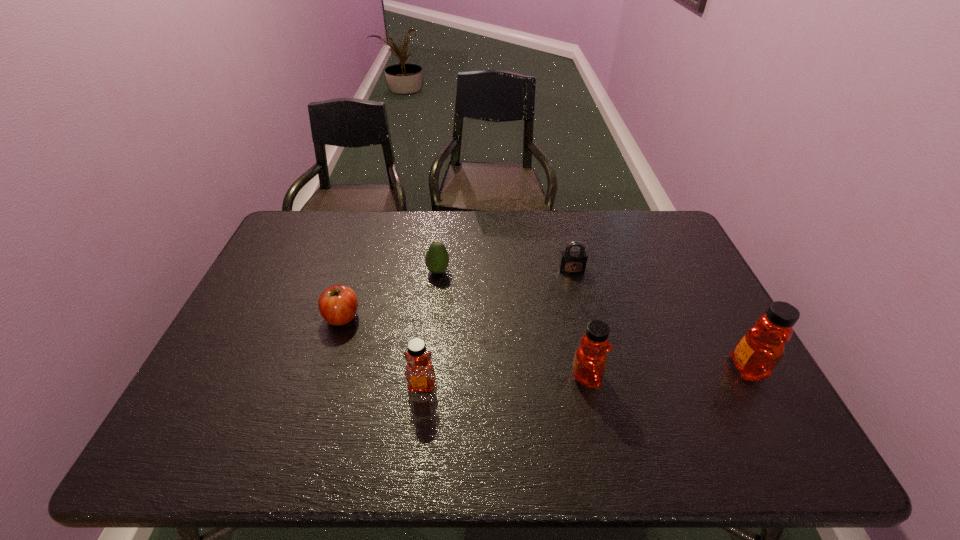
At what (x,y) coordinates should I click in order to perform the action: click on vacant area that lies between the apple and the avocado. Please return your answer as a coordinate pair (x, y). This screenshot has width=960, height=540. Looking at the image, I should click on (390, 294).

Locate an element on the screen. This screenshot has width=960, height=540. vacant point located between the avocado and the rightmost object is located at coordinates (592, 320).

Find the location of `free space between the avocado and the padlock`. free space between the avocado and the padlock is located at coordinates (505, 271).

The width and height of the screenshot is (960, 540). Identify the location of vacant region between the rightmost honey and the second honey from left to right. (667, 373).

Image resolution: width=960 pixels, height=540 pixels. What are the coordinates of `the fourth closest object to the leftmost object` in the screenshot? It's located at (571, 262).

Select which object is the fifth closest to the padlock. Please provide its 2D coordinates. Your answer should be formatted as a tuple, i.e. [(x, y)], where the tuple contains the x and y coordinates of a point satisfying the conditions above.

[(338, 304)]

Select which honey appears as the second closest to the rightmost honey. Please provide its 2D coordinates. Your answer should be formatted as a tuple, i.e. [(x, y)], where the tuple contains the x and y coordinates of a point satisfying the conditions above.

[(419, 372)]

Point out which honey is positioned as the second nearest to the leftmost object. Please provide its 2D coordinates. Your answer should be formatted as a tuple, i.e. [(x, y)], where the tuple contains the x and y coordinates of a point satisfying the conditions above.

[(588, 367)]

The height and width of the screenshot is (540, 960). Find the location of `vacant space that satisfies the following two spatial constraints: 1. on the front label of the second shortest honey; 2. on the front label of the third tallest object`. vacant space that satisfies the following two spatial constraints: 1. on the front label of the second shortest honey; 2. on the front label of the third tallest object is located at coordinates (588, 385).

The image size is (960, 540). What are the coordinates of `free space in the image that satisfies the following two spatial constraints: 1. on the front of the padlock near the keyhole; 2. on the front label of the second honey from right to left` in the screenshot? It's located at (596, 376).